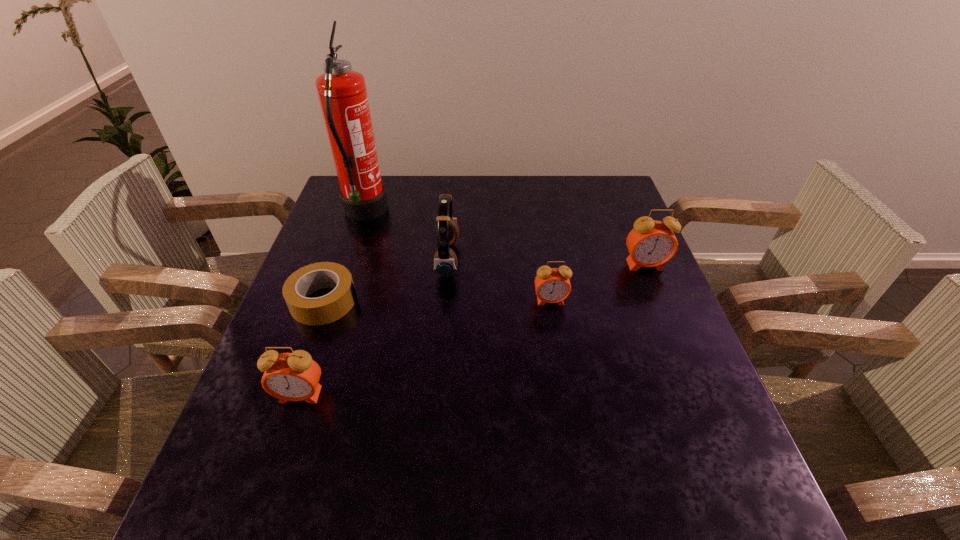
This screenshot has height=540, width=960. Identify the location of free space that satisfies the following two spatial constraints: 1. on the face of the second alarm clock from left to right; 2. at the edge of the shortest object. (550, 301).

This screenshot has width=960, height=540. Find the location of `blank area in the image that satisfies the following two spatial constraints: 1. on the ear cup of the fourth object from left to right; 2. on the face of the nearest object`. blank area in the image that satisfies the following two spatial constraints: 1. on the ear cup of the fourth object from left to right; 2. on the face of the nearest object is located at coordinates (437, 395).

You are a GUI agent. You are given a task and a screenshot of the screen. Output one action in this format:
    pyautogui.click(x=<x>, y=<y>)
    Task: Click on the free location that satisfies the following two spatial constraints: 1. on the face of the second shortest object; 2. at the edge of the duct tape
    
    Given the screenshot: What is the action you would take?
    pyautogui.click(x=550, y=301)